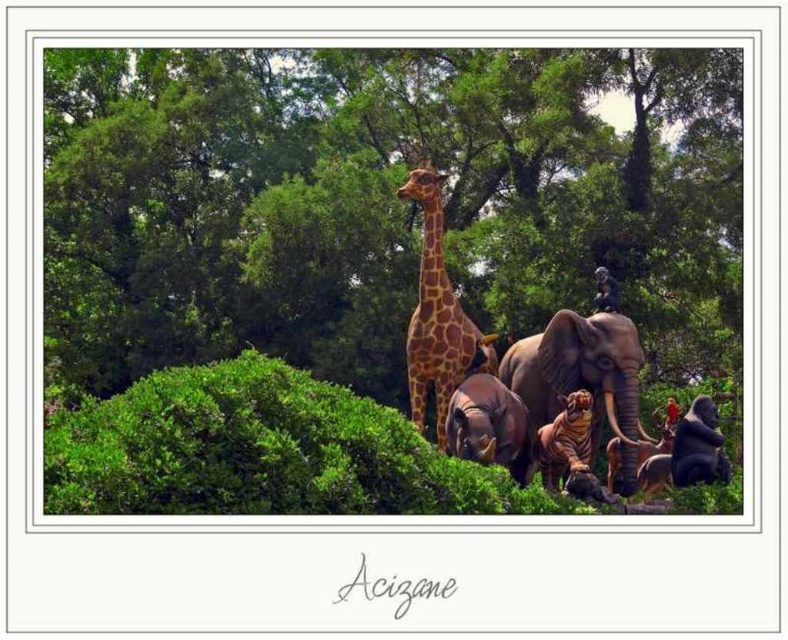
Question: Is rustic brown elephant at center further to the viewer compared to shiny brown tiger at center?

Choices:
 (A) no
 (B) yes

Answer: (B)

Question: Which point is farther to the camera?

Choices:
 (A) shiny brown tiger at center
 (B) metallic statue at center
 (C) rustic brown elephant at center
 (D) shiny black gorilla at lower right

Answer: (D)

Question: Estimate the real-world distances between objects in this image. Which object is farther from the rustic brown elephant at center?

Choices:
 (A) shiny brown tiger at center
 (B) brown matte elephant at center
 (C) brown spotted giraffe at center
 (D) metallic statue at center

Answer: (D)

Question: Which object is positioned closest to the shiny black gorilla at lower right?

Choices:
 (A) brown matte elephant at center
 (B) shiny brown tiger at center
 (C) rustic brown elephant at center
 (D) metallic statue at center

Answer: (C)

Question: Is rustic brown elephant at center above shiny brown tiger at center?

Choices:
 (A) yes
 (B) no

Answer: (A)

Question: Can you confirm if brown spotted giraffe at center is positioned below shiny black gorilla at lower right?

Choices:
 (A) no
 (B) yes

Answer: (A)